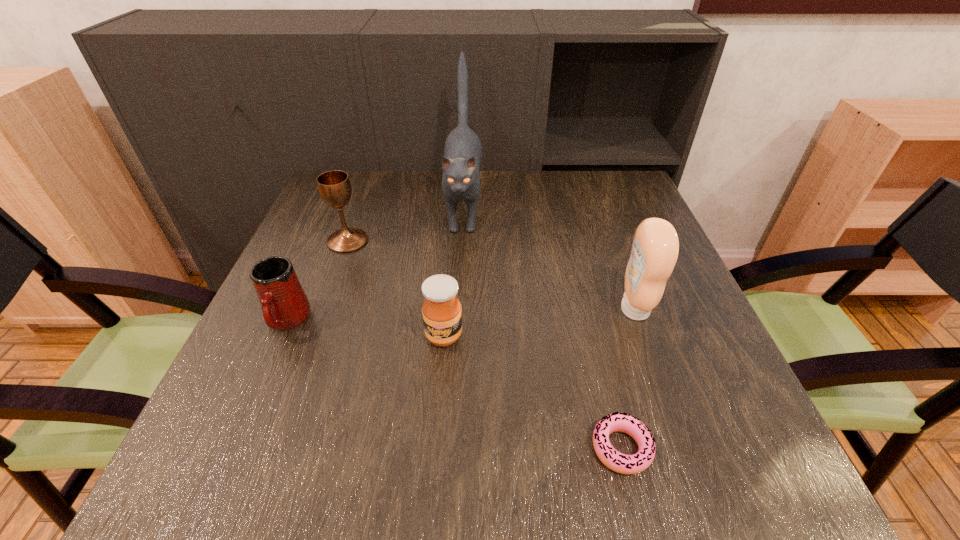
The width and height of the screenshot is (960, 540). What are the coordinates of `vacant space located 0.400m on the label of the condiment` in the screenshot? It's located at (422, 309).

Image resolution: width=960 pixels, height=540 pixels. I want to click on free space located on the label of the condiment, so click(x=432, y=309).

Where is `free spot located on the right of the third tallest object`? The image size is (960, 540). free spot located on the right of the third tallest object is located at coordinates (508, 241).

Image resolution: width=960 pixels, height=540 pixels. I want to click on free space located 0.230m on the front-facing side of the honey, so click(433, 475).

Where is `free spot located 0.180m on the side of the mug with the handle`? The image size is (960, 540). free spot located 0.180m on the side of the mug with the handle is located at coordinates (239, 433).

The height and width of the screenshot is (540, 960). In order to click on vacant space located 0.060m on the back of the fifth object from left to right in this screenshot , I will do `click(607, 389)`.

This screenshot has height=540, width=960. I want to click on object that is at the far edge, so click(x=462, y=157).

At what (x,y) coordinates should I click in order to perform the action: click on object present at the near edge. Please return your answer as a coordinate pair (x, y). This screenshot has width=960, height=540. Looking at the image, I should click on (621, 463).

Where is `chalice positioned at the left edge`? chalice positioned at the left edge is located at coordinates (334, 186).

Image resolution: width=960 pixels, height=540 pixels. Find the location of `mug present at the left edge`. mug present at the left edge is located at coordinates (284, 304).